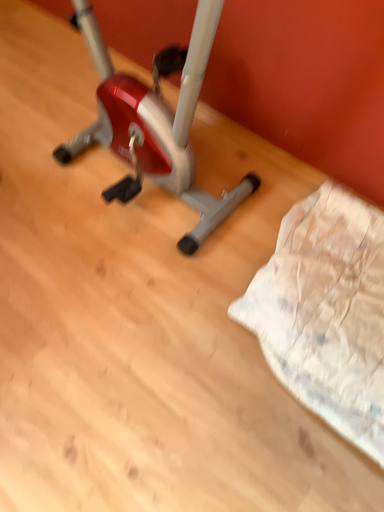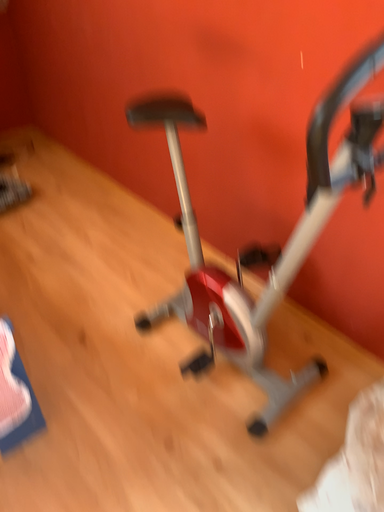
Question: Which way did the camera rotate in the video?

Choices:
 (A) rotated upward
 (B) rotated downward

Answer: (A)